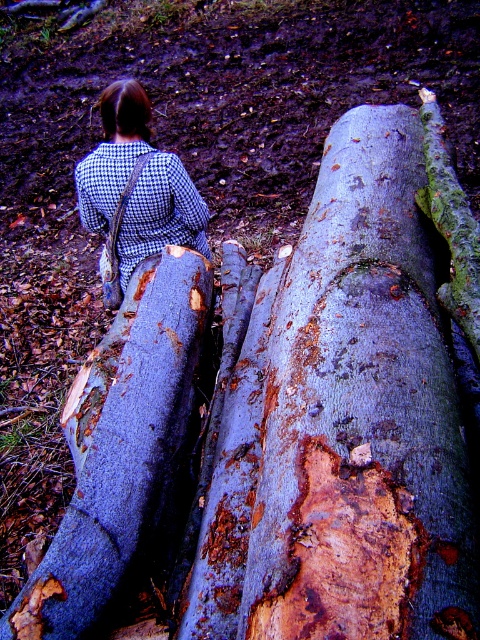
Question: Which of the following is the farthest from the observer?

Choices:
 (A) (168, 189)
 (B) (149, 532)
 (C) (284, 476)

Answer: (A)

Question: Which of these objects is positioned closest to the rusty wood log at center?

Choices:
 (A) checkered fabric coat at center
 (B) rusty bark log at center

Answer: (B)

Question: Is rusty bark log at center closer to the viewer compared to checkered fabric coat at center?

Choices:
 (A) yes
 (B) no

Answer: (A)

Question: Can you confirm if rusty bark log at center is positioned above checkered fabric coat at center?

Choices:
 (A) no
 (B) yes

Answer: (A)

Question: Based on their relative distances, which object is nearer to the rusty bark log at center?

Choices:
 (A) rusty wood log at center
 (B) checkered fabric coat at center

Answer: (A)

Question: Does rusty bark log at center come in front of checkered fabric coat at center?

Choices:
 (A) no
 (B) yes

Answer: (B)